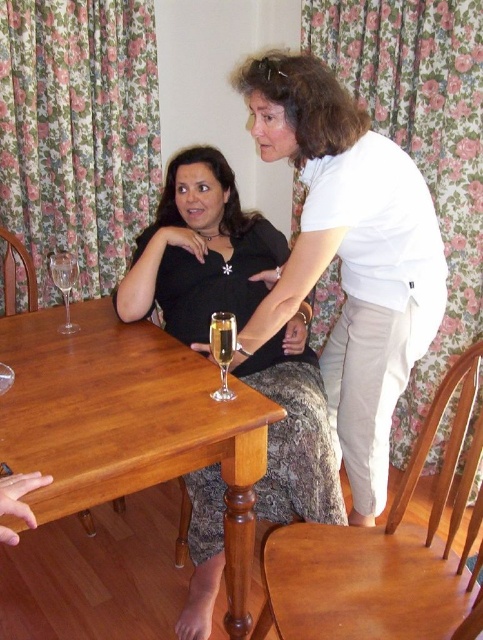
Does point (59, 280) come behind point (212, 353)?

Yes.

Does clear glass wine glass at table left have a greater width compared to clear glass champagne at table center?

Correct, the width of clear glass wine glass at table left exceeds that of clear glass champagne at table center.

Is point (52, 256) closer to viewer compared to point (228, 328)?

That is False.

Where is `clear glass wine glass at table left`? The height and width of the screenshot is (640, 483). clear glass wine glass at table left is located at coordinates (64, 284).

Which is below, wooden table at center or black matte dress at center?

wooden table at center is below.

Which is in front, point (142, 458) or point (202, 483)?

Point (142, 458) is more forward.

Find the location of a particular element. This screenshot has height=640, width=483. wooden table at center is located at coordinates (128, 424).

Image resolution: width=483 pixels, height=640 pixels. I want to click on wooden table at center, so point(128,424).

Who is taller, black matte dress at center or clear glass wine glass at table?

With more height is black matte dress at center.

Does black matte dress at center appear under clear glass wine glass at table?

Yes, black matte dress at center is below clear glass wine glass at table.

Locate an element on the screen. black matte dress at center is located at coordinates (199, 250).

Where is `black matte dress at center`? black matte dress at center is located at coordinates (199, 250).